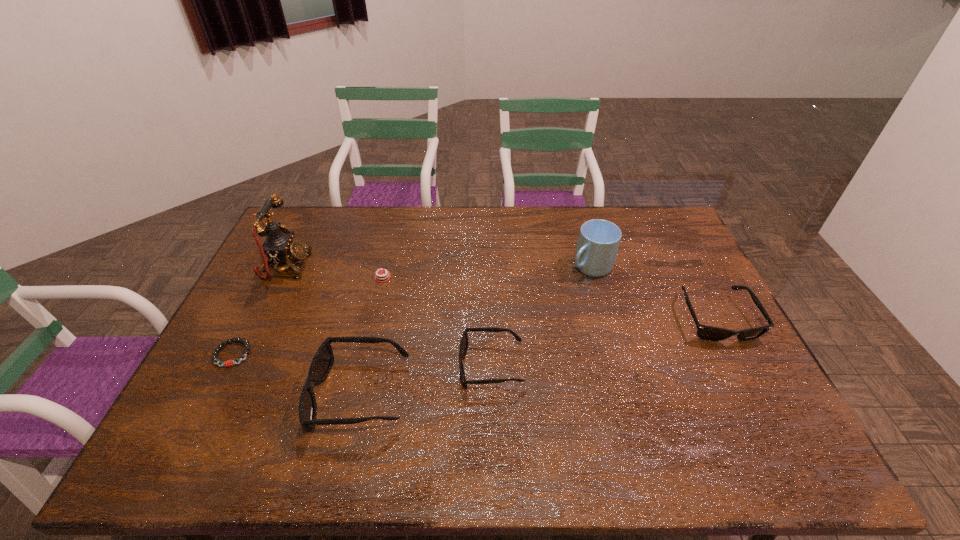
You are a GUI agent. You are given a task and a screenshot of the screen. Output one action in this format:
    pyautogui.click(x=<x>, y=<y>)
    Task: Click on the leftmost sunglasses
    The width and height of the screenshot is (960, 540).
    Given the screenshot: What is the action you would take?
    pyautogui.click(x=323, y=360)

At what (x,y) coordinates should I click in order to perform the action: click on the shortest sunglasses. Please return your answer as a coordinate pair (x, y). The image size is (960, 540). Looking at the image, I should click on (464, 342).

Identify the location of the third shortest object. (464, 342).

Where is `the second tallest sunglasses`? The image size is (960, 540). the second tallest sunglasses is located at coordinates (709, 333).

You are a GUI agent. You are given a task and a screenshot of the screen. Output one action in this format:
    pyautogui.click(x=<x>, y=<y>)
    Task: Click on the rightmost object
    Image resolution: width=960 pixels, height=540 pixels.
    Given the screenshot: What is the action you would take?
    pyautogui.click(x=709, y=333)

Where is `the sixth shortest object`? the sixth shortest object is located at coordinates (598, 242).

This screenshot has height=540, width=960. I want to click on the second object from right to left, so click(x=598, y=242).

Find the location of a particular element. telephone is located at coordinates (279, 247).

The width and height of the screenshot is (960, 540). I want to click on bracelet, so click(228, 363).

Where is `the sixth tallest object`? This screenshot has height=540, width=960. the sixth tallest object is located at coordinates (378, 277).